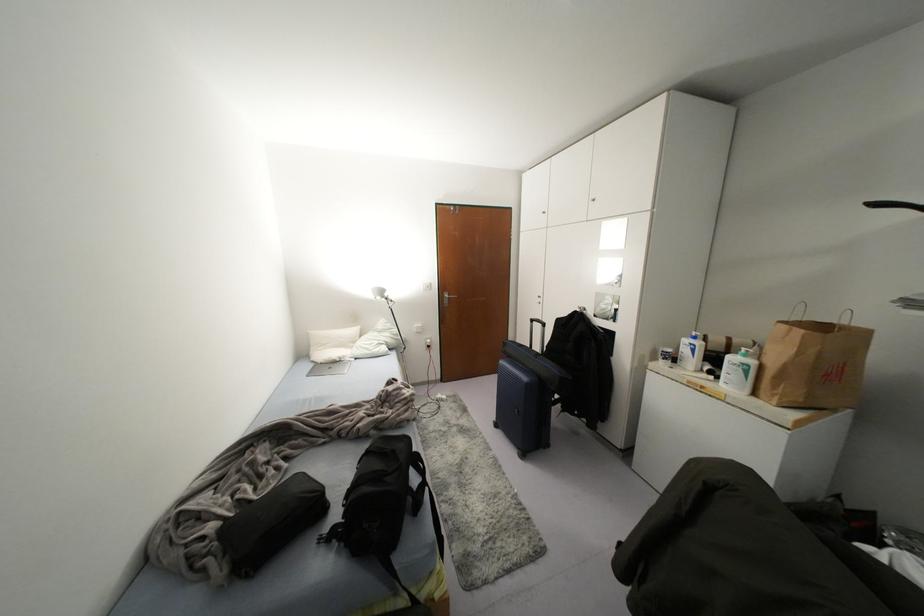
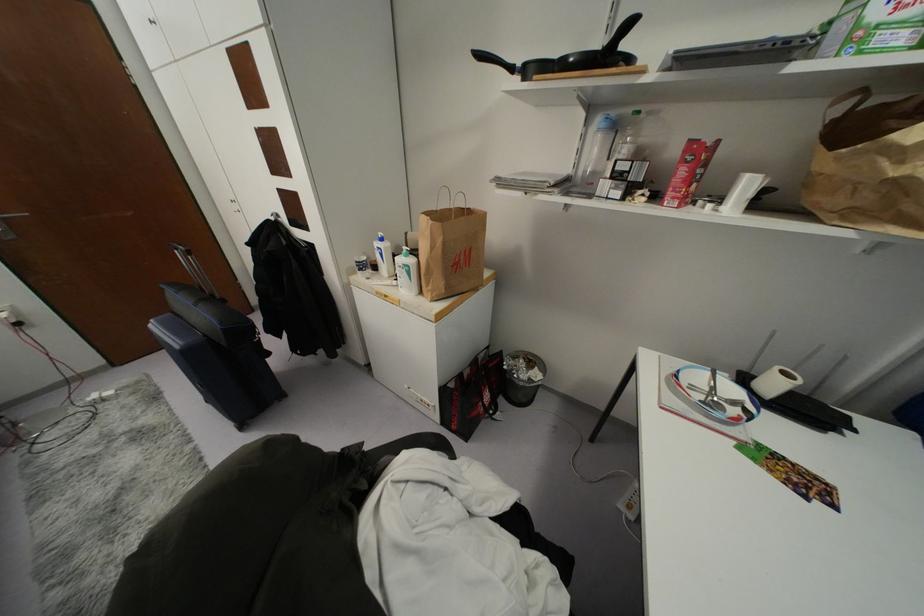
Find the pixel in the second image that matches point (751, 362) in the first image.

(410, 261)